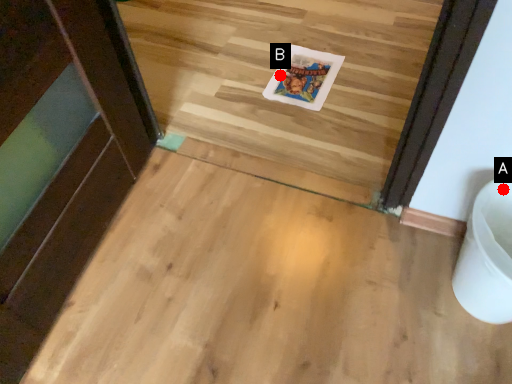
Question: Two points are circled on the image, labeled by A and B beside each circle. Which point is further to the camera?

Choices:
 (A) A is further
 (B) B is further

Answer: (B)